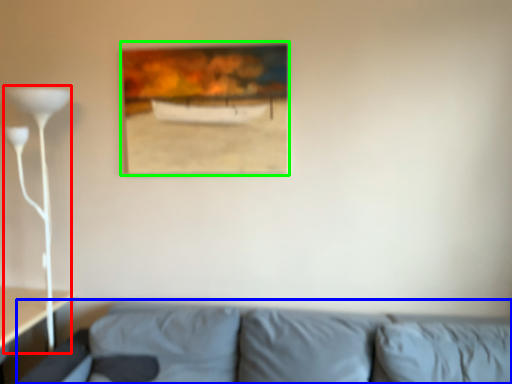
Question: Considering the real-world distances, which object is farthest from table lamp (highlighted by a red box)? studio couch (highlighted by a blue box) or picture frame (highlighted by a green box)?

Choices:
 (A) studio couch
 (B) picture frame

Answer: (A)